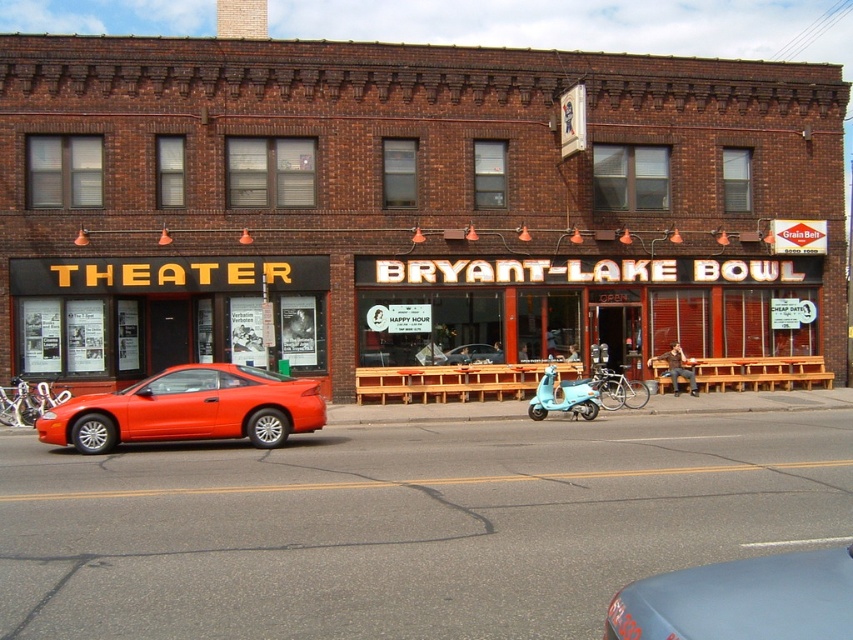
Question: Can you confirm if brick theater at center is positioned above matte blue car at lower center?

Choices:
 (A) yes
 (B) no

Answer: (A)

Question: Among these objects, which one is nearest to the camera?

Choices:
 (A) brick theater at center
 (B) shiny orange car at left
 (C) matte blue car at lower center
 (D) shiny red car at center

Answer: (C)

Question: Is shiny orange car at left thinner than light blue matte scooter at center?

Choices:
 (A) yes
 (B) no

Answer: (B)

Question: Does matte blue car at lower center lie in front of light blue matte scooter at center?

Choices:
 (A) no
 (B) yes

Answer: (B)

Question: Which of the following is the closest to the observer?

Choices:
 (A) light blue matte scooter at center
 (B) shiny orange car at left
 (C) matte blue car at lower center

Answer: (C)

Question: Among these points, which one is nearest to the camera?

Choices:
 (A) (212, 380)
 (B) (123, 108)
 (C) (581, 387)

Answer: (A)